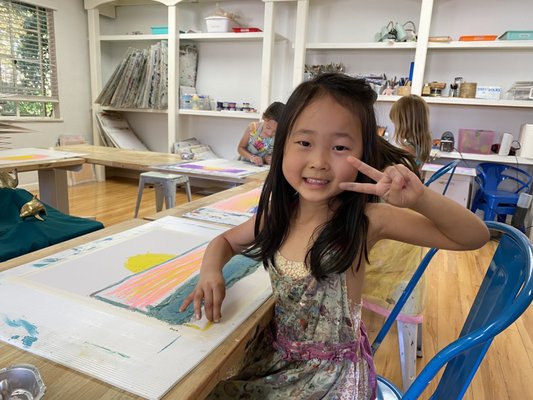
Where is `shelves`? This screenshot has height=400, width=533. shelves is located at coordinates (494, 103), (365, 46), (214, 111), (125, 106).